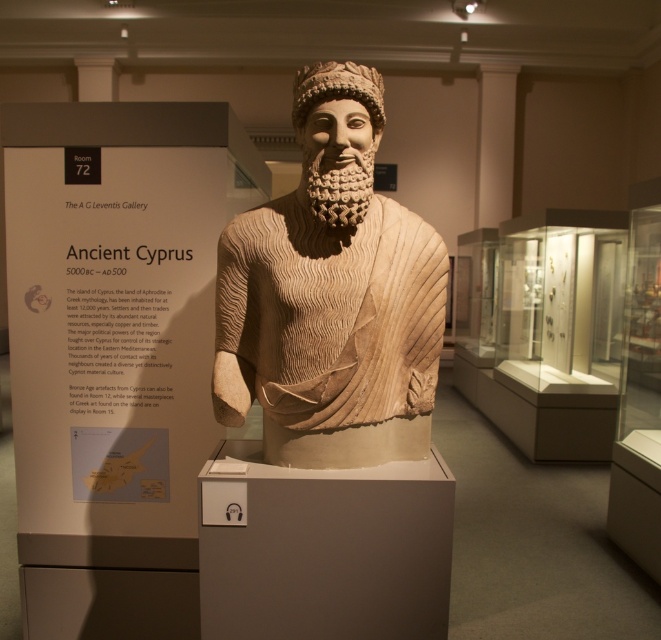
Can you confirm if beige stone bust at center is thinner than beige textured beard at center?

No, beige stone bust at center is not thinner than beige textured beard at center.

Who is taller, beige stone bust at center or beige textured beard at center?

beige stone bust at center

Is point (344, 122) less distant than point (301, 179)?

Yes, point (344, 122) is closer to viewer.

Where is `beige stone bust at center`? This screenshot has height=640, width=661. beige stone bust at center is located at coordinates (330, 296).